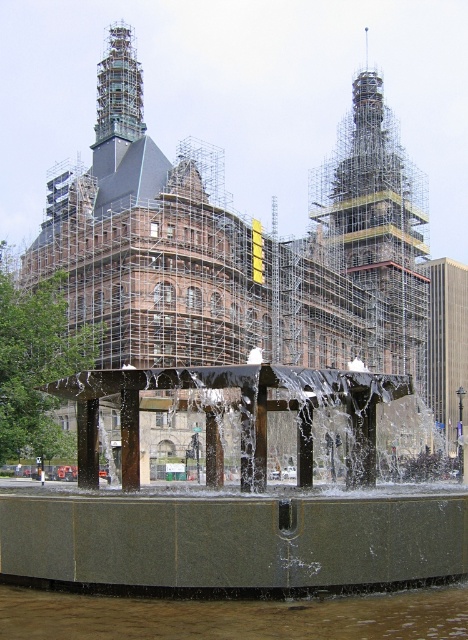
Is green stone fountain at center shorter than clear water at fountain bottom?

In fact, green stone fountain at center may be taller than clear water at fountain bottom.

What are the coordinates of `green stone fountain at center` in the screenshot? It's located at (233, 502).